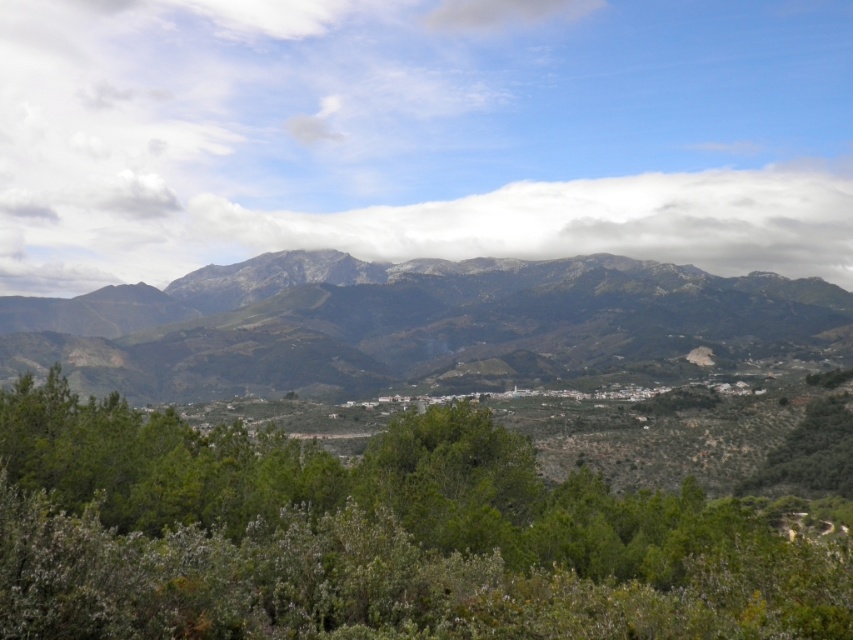
Which of these two, green leafy tree at center or rocky gray mountain range at center, stands shorter?

green leafy tree at center

Measure the distance between point (102, 556) and camera.

The distance of point (102, 556) from camera is 83.94 feet.

Is point (500, 492) farther from viewer compared to point (106, 308)?

No, it is in front of (106, 308).

Find the location of a particular element. green leafy tree at center is located at coordinates (369, 538).

Can you confirm if green leafy tree at center is thinner than white fluffy cloud at center?

Indeed, green leafy tree at center has a lesser width compared to white fluffy cloud at center.

Which is above, green leafy tree at center or white fluffy cloud at center?

white fluffy cloud at center

Does point (637, 600) come in front of point (807, 195)?

Yes, point (637, 600) is in front of point (807, 195).

Where is `green leafy tree at center`? green leafy tree at center is located at coordinates (369, 538).

This screenshot has height=640, width=853. Find the location of `rocky gray mountain range at center`. rocky gray mountain range at center is located at coordinates (395, 321).

Which is below, rocky gray mountain range at center or white fluffy cloud at center?

rocky gray mountain range at center is lower down.

Consider the image. Who is more distant from viewer, [125,369] or [660,259]?

Point [660,259]

Where is `rocky gray mountain range at center`? rocky gray mountain range at center is located at coordinates (395, 321).